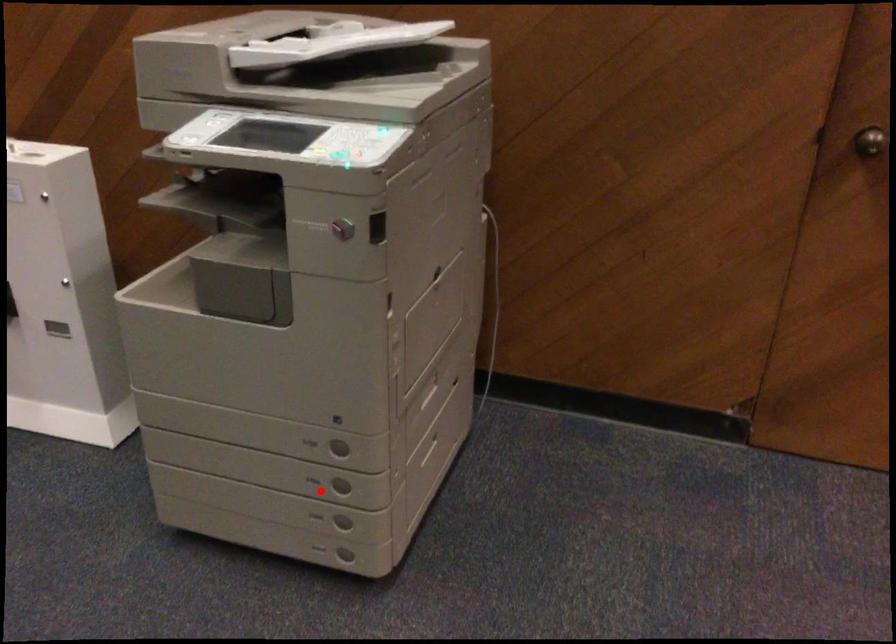
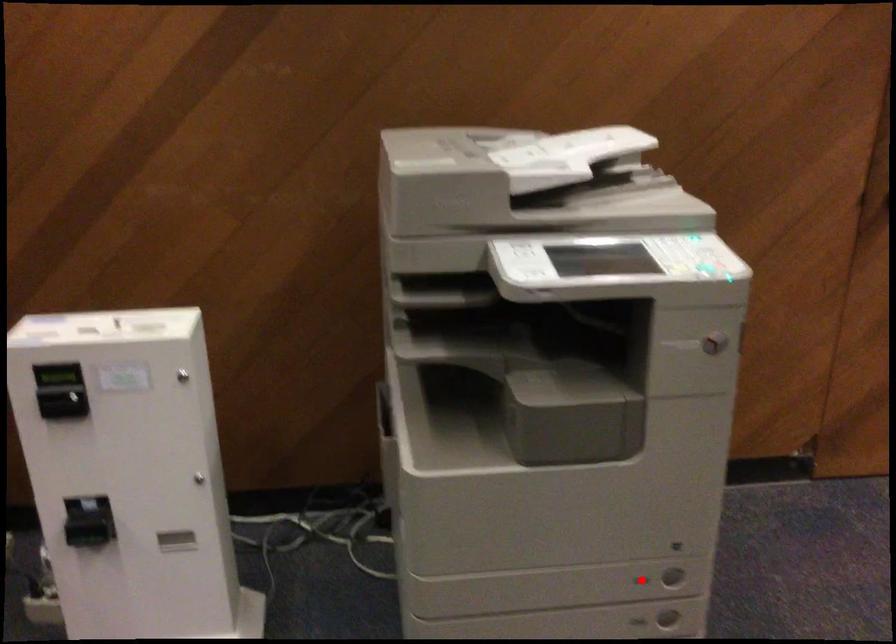
I am providing you with two images of the same scene from different viewpoints. A red point is marked on the first image and another point is marked on the second image. Is the red point in image1 aligned with the point shown in image2?

No